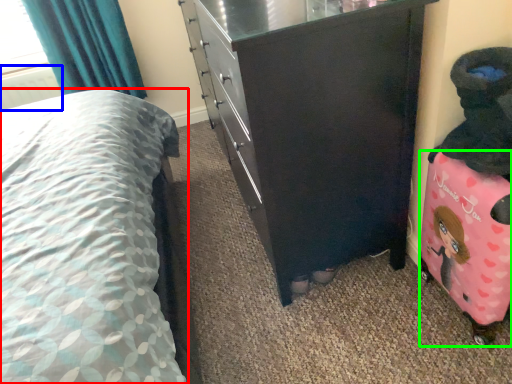
Question: Which object is the closest to the bed (highlighted by a red box)? Choose among these: radiator (highlighted by a blue box) or luggage (highlighted by a green box).

Choices:
 (A) radiator
 (B) luggage

Answer: (B)